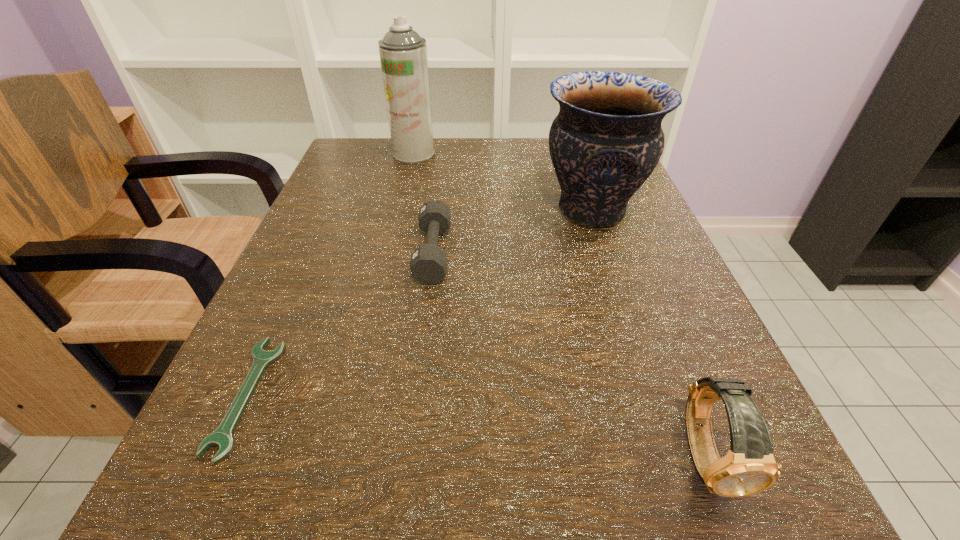
At what (x,y) coordinates should I click in order to perform the action: click on free space located on the front handle of the fourth shortest object. Please return your answer as a coordinate pair (x, y). The image size is (960, 540). Looking at the image, I should click on point(382,211).

Where is `vacant space situated 0.180m on the back of the fourth tallest object`? vacant space situated 0.180m on the back of the fourth tallest object is located at coordinates (443, 176).

In order to click on free point located on the back of the leftmost object in this screenshot , I will do [295, 290].

Locate an element on the screen. The height and width of the screenshot is (540, 960). aerosol can situated at the far edge is located at coordinates (403, 53).

Identify the location of pottery that is at the far edge. The height and width of the screenshot is (540, 960). (606, 140).

Locate an element on the screen. This screenshot has height=540, width=960. watch located at the near edge is located at coordinates (749, 467).

You are a GUI agent. You are given a task and a screenshot of the screen. Output one action in this format:
    pyautogui.click(x=<x>, y=<y>)
    Task: Click on the wrench present at the near edge
    
    Given the screenshot: What is the action you would take?
    pyautogui.click(x=222, y=437)

This screenshot has width=960, height=540. In order to click on aerosol can that is at the left edge in this screenshot , I will do `click(403, 53)`.

This screenshot has height=540, width=960. I want to click on wrench that is at the left edge, so [222, 437].

Locate an element on the screen. pottery positioned at the right edge is located at coordinates (606, 140).